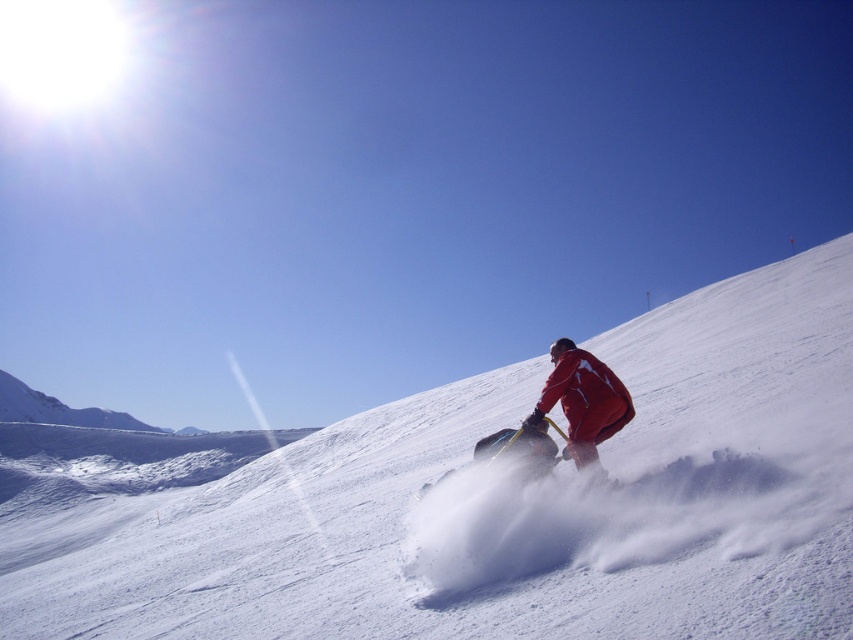
You are a photographer trying to capture the person sledding. You notice the red matte jacket at center and the shiny black snowboard at center. Which object should you focus on to ensure the subject is in sharp focus?

You should focus on the red matte jacket at center because the shiny black snowboard at center is behind it, meaning the jacket is closer to the camera and thus in focus.

You are a photographer aiming to capture the white powdery snow at center and the shiny black snowboard at center in a single shot. Which object will appear larger in the photo if you focus on the one with greater height?

The white powdery snow at center will appear larger in the photo because it has a greater height compared to the shiny black snowboard at center.

You are standing at the top of the slope and see the white powdery snow at center and the red matte jacket at center. Which object is positioned to the left of the other?

The white powdery snow at center is to the left of the red matte jacket at center.